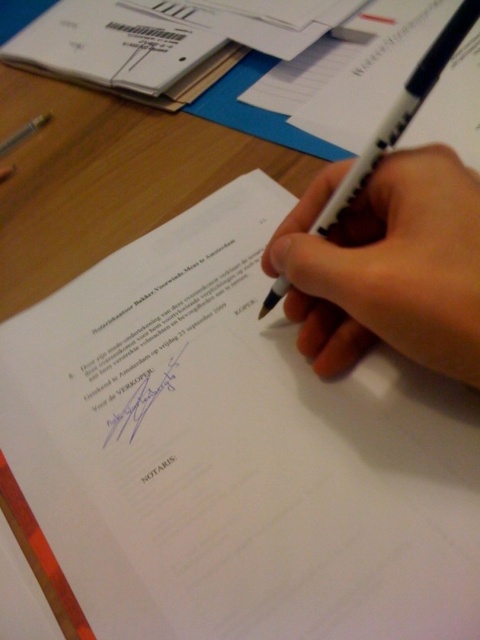
You are a notary who needs to sign a document. The document has a red and orange binding strip at the bottom left corner. Where should you place your signature relative to the white matte pen at center?

The white matte pen at center is located at point (387, 266). Since the pen is at the center, you should sign below the white matte pen at center, near the red and orange binding strip at the bottom left corner to ensure proper placement on the document.

You are a notary public who needs to initial the document at point (387, 266). Where should you place your initials on the document?

The white matte pen at center is located at point (387, 266), so you should place your initials there.

You are a notary who needs to sign a document. You have two pens at your disposal, the white matte pen at center and the white plastic pen at center. If you need to place both pens on the document without overlapping, how much space do you need at minimum?

The minimum space needed is 1.62 inches between the white matte pen at center and the white plastic pen at center to prevent overlapping.